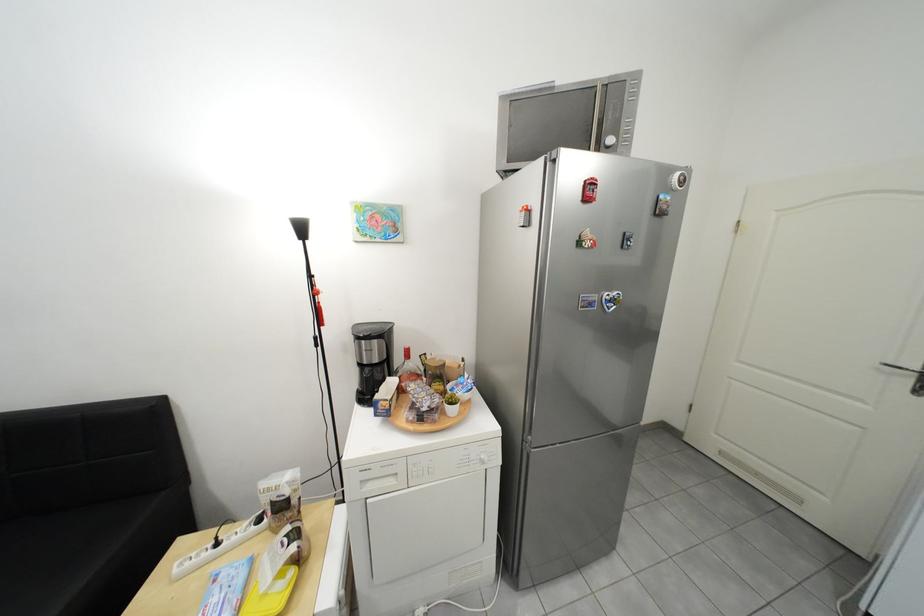
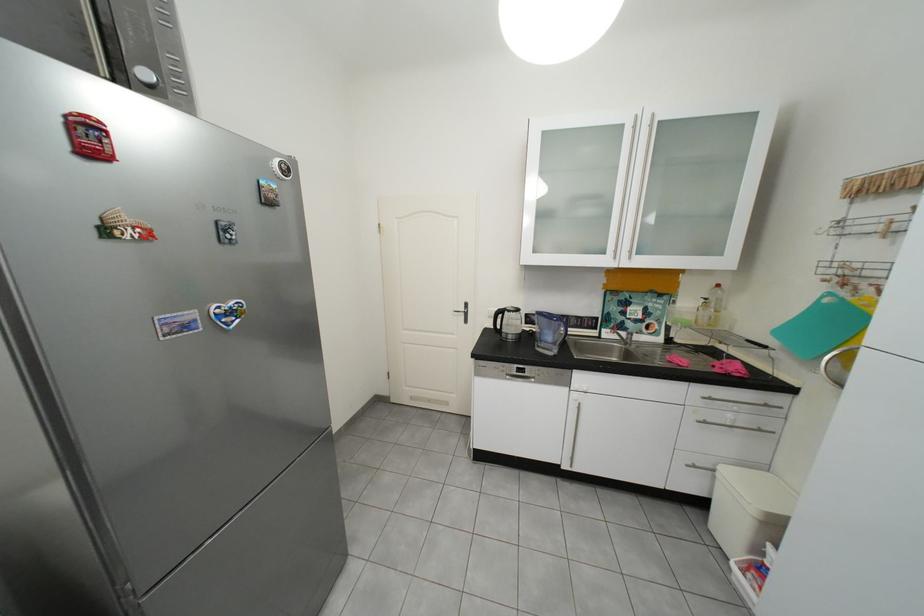
Find the pixel in the second image that matches pixel 598 183 in the first image.

(77, 118)